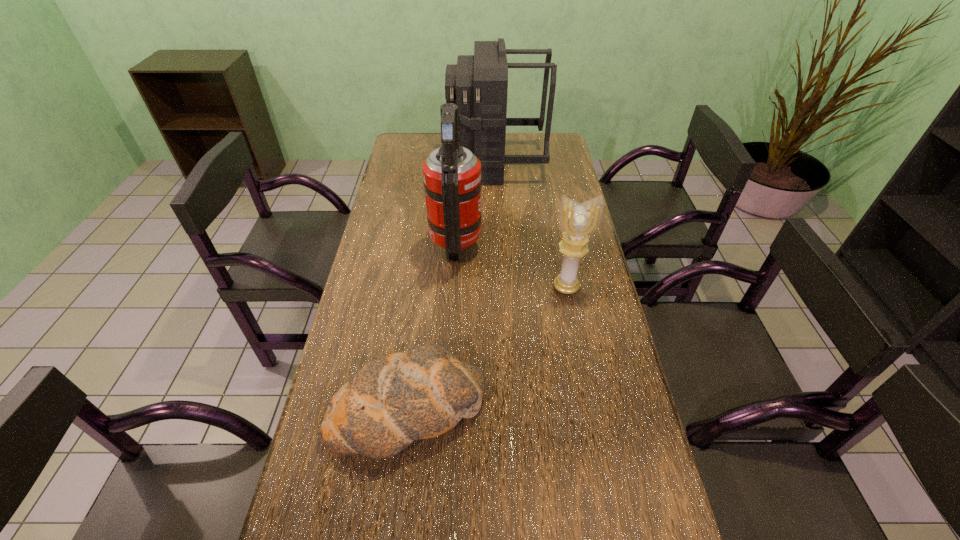
Where is `vacant region between the nearest object and the fire extinguisher`? The width and height of the screenshot is (960, 540). vacant region between the nearest object and the fire extinguisher is located at coordinates (432, 326).

This screenshot has height=540, width=960. Find the location of `free space between the bread and the fire extinguisher`. free space between the bread and the fire extinguisher is located at coordinates (432, 326).

This screenshot has height=540, width=960. Find the location of `vacant space in between the award and the fire extinguisher`. vacant space in between the award and the fire extinguisher is located at coordinates (x=511, y=265).

Locate an element on the screen. free space that is in between the bread and the third farthest object is located at coordinates (487, 348).

Find the location of a particular element. Image resolution: width=960 pixels, height=540 pixels. empty location between the award and the shortest object is located at coordinates (487, 348).

Where is `empty space between the shortest object and the second farthest object`? The height and width of the screenshot is (540, 960). empty space between the shortest object and the second farthest object is located at coordinates (432, 326).

Image resolution: width=960 pixels, height=540 pixels. In order to click on vacant space that is in between the second nearest object and the bread in this screenshot , I will do `click(487, 348)`.

The width and height of the screenshot is (960, 540). Find the location of `vacant area that lies between the nearest object and the award`. vacant area that lies between the nearest object and the award is located at coordinates (487, 348).

Identify which object is the second nearest to the third tallest object. Please provide its 2D coordinates. Your answer should be formatted as a tuple, i.e. [(x, y)], where the tuple contains the x and y coordinates of a point satisfying the conditions above.

[(393, 399)]

Point out which object is positioned as the third nearest to the farthest object. Please provide its 2D coordinates. Your answer should be formatted as a tuple, i.e. [(x, y)], where the tuple contains the x and y coordinates of a point satisfying the conditions above.

[(393, 399)]